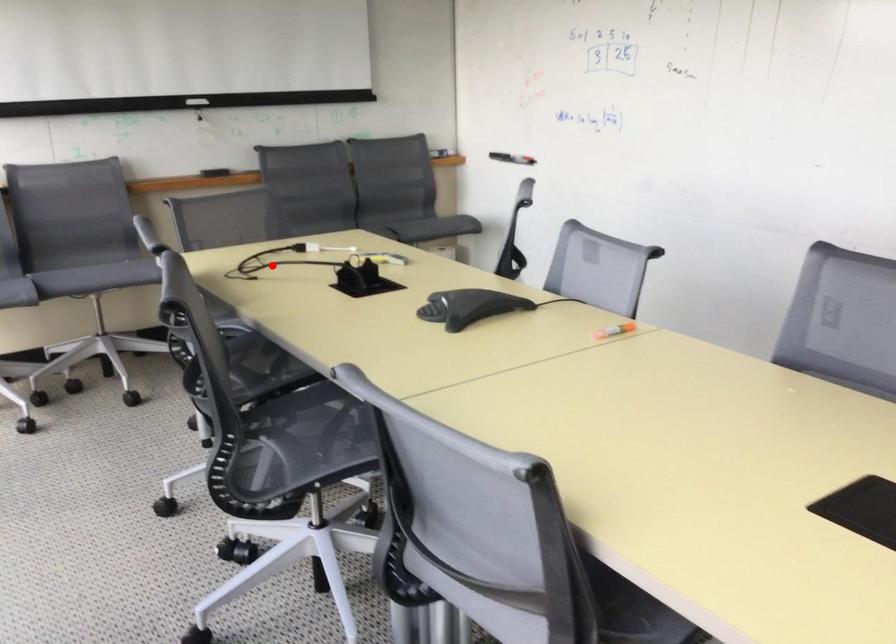
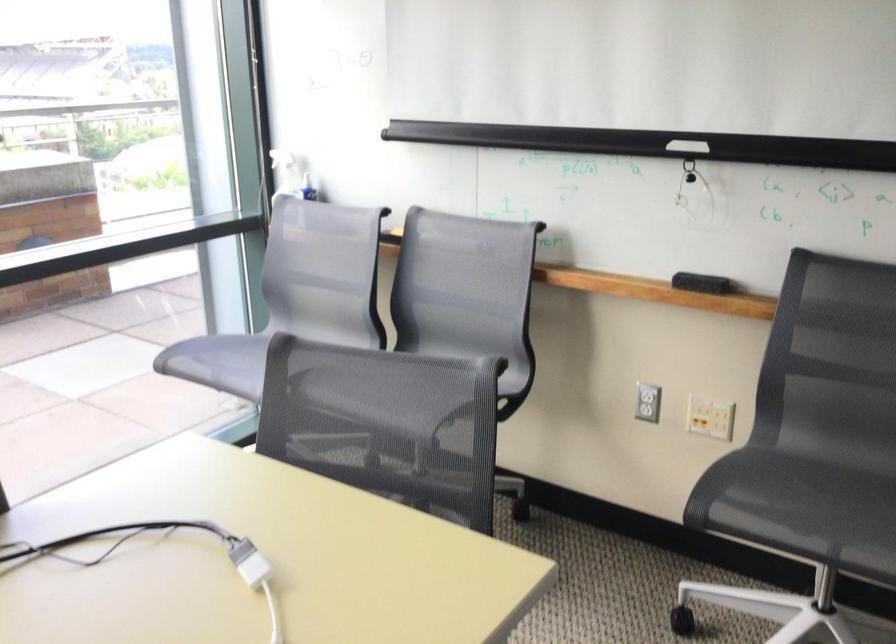
Find the pixel in the second image that matches the highlighted location in the first image.

(161, 554)